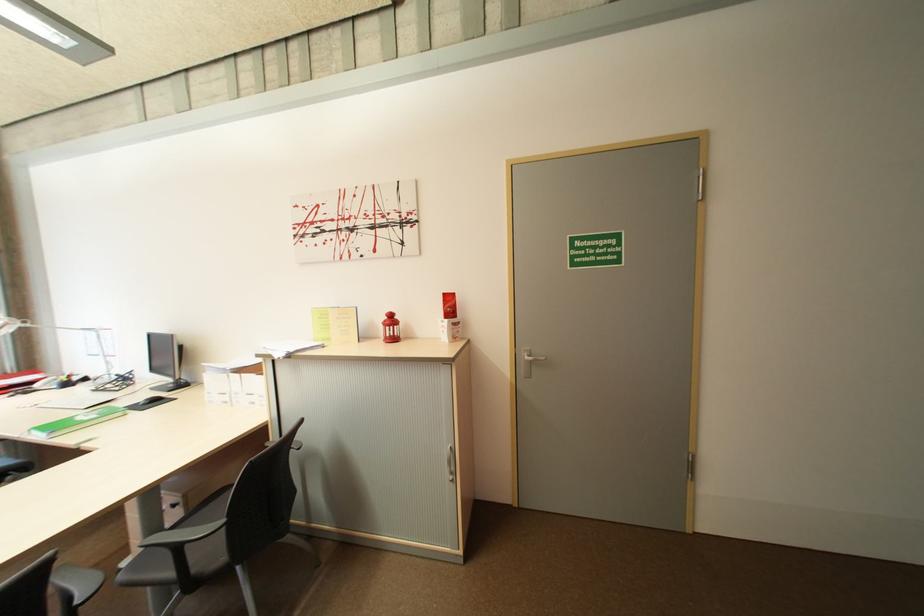
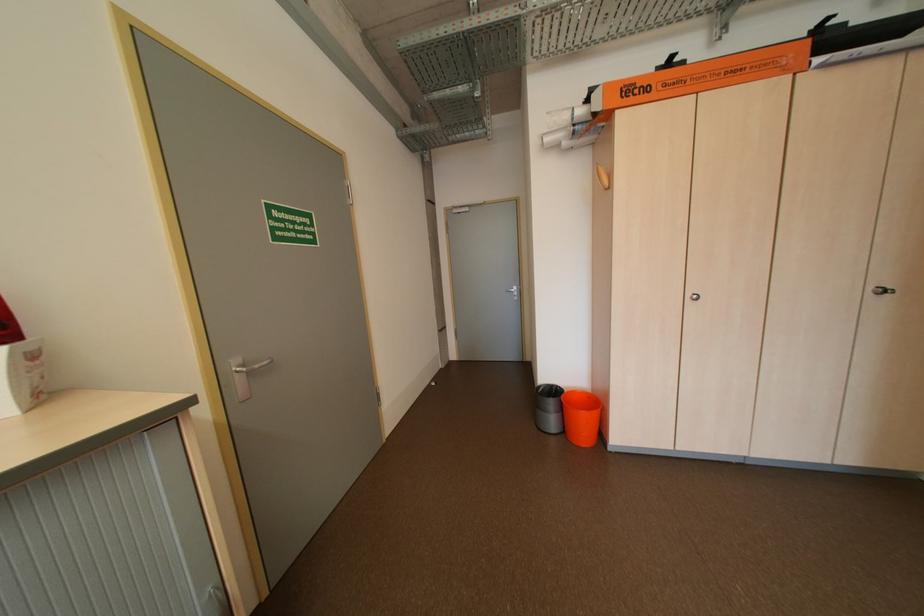
Find the pixel in the second image that matches (455,331) in the first image.

(6, 383)